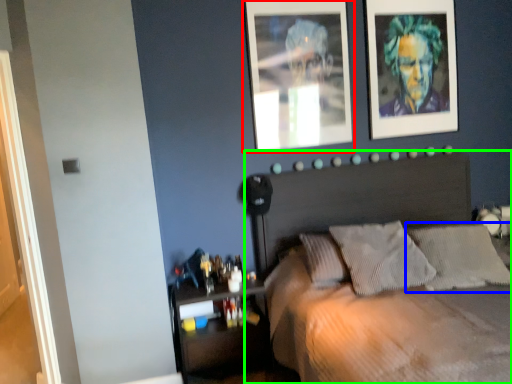
Question: Which object is the closest to the picture frame (highlighted by a red box)? Choose among these: pillow (highlighted by a blue box) or bed (highlighted by a green box).

Choices:
 (A) pillow
 (B) bed

Answer: (B)